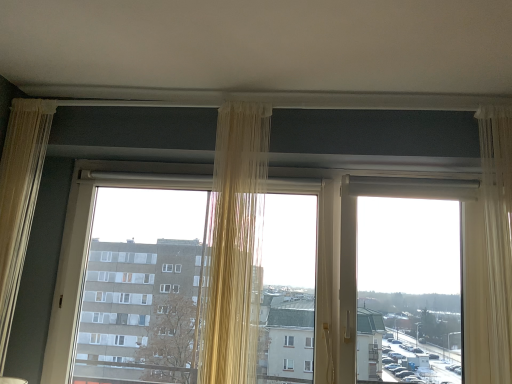
Question: From the image's perspective, would you say sheer beige curtain at left, the 1th curtain from the left, is positioned over translucent fabric at center?

Choices:
 (A) yes
 (B) no

Answer: (A)

Question: Does sheer beige curtain at left, the 1th curtain from the left, have a lesser height compared to translucent fabric at center?

Choices:
 (A) no
 (B) yes

Answer: (A)

Question: From a real-world perspective, is sheer beige curtain at left, the 3th curtain positioned from the right, physically above translucent fabric at center?

Choices:
 (A) yes
 (B) no

Answer: (A)

Question: Is sheer beige curtain at left, the 3th curtain positioned from the right, placed right next to translucent fabric at center?

Choices:
 (A) yes
 (B) no

Answer: (B)

Question: Does sheer beige curtain at left, the 3th curtain positioned from the right, have a greater width compared to translucent fabric at center?

Choices:
 (A) no
 (B) yes

Answer: (A)

Question: From a real-world perspective, relative to sheer beige curtain at left, the 1th curtain from the left, is translucent beige curtain at center, positioned as the 2th curtain in right-to-left order, vertically above or below?

Choices:
 (A) below
 (B) above

Answer: (B)

Question: In terms of height, does translucent beige curtain at center, positioned as the 2th curtain in right-to-left order, look taller or shorter compared to sheer beige curtain at left, the 3th curtain positioned from the right?

Choices:
 (A) tall
 (B) short

Answer: (B)

Question: Which is correct: translucent beige curtain at center, positioned as the 2th curtain in right-to-left order, is inside sheer beige curtain at left, the 1th curtain from the left, or outside of it?

Choices:
 (A) inside
 (B) outside

Answer: (B)

Question: Looking at the image, does translucent beige curtain at center, positioned as the 2th curtain in right-to-left order, seem bigger or smaller compared to sheer beige curtain at left, the 1th curtain from the left?

Choices:
 (A) big
 (B) small

Answer: (A)

Question: Is translucent beige curtain at center, positioned as the 2th curtain in right-to-left order, in front of or behind transparent plastic window screen at right in the image?

Choices:
 (A) behind
 (B) front

Answer: (B)

Question: From a real-world perspective, is translucent beige curtain at center, positioned as the 2th curtain in right-to-left order, physically located above or below transparent plastic window screen at right?

Choices:
 (A) above
 (B) below

Answer: (A)

Question: Is translucent beige curtain at center, positioned as the 2th curtain in right-to-left order, bigger or smaller than transparent plastic window screen at right?

Choices:
 (A) small
 (B) big

Answer: (A)

Question: Is translucent beige curtain at center, positioned as the 2th curtain in right-to-left order, taller or shorter than transparent plastic window screen at right?

Choices:
 (A) tall
 (B) short

Answer: (A)

Question: Based on their positions, is translucent beige curtain at center, the second curtain positioned from the left, located to the left or right of sheer white curtain at right, the first curtain in the right-to-left sequence?

Choices:
 (A) right
 (B) left

Answer: (B)

Question: From the image's perspective, relative to sheer white curtain at right, the first curtain in the right-to-left sequence, is translucent beige curtain at center, positioned as the 2th curtain in right-to-left order, above or below?

Choices:
 (A) below
 (B) above

Answer: (A)